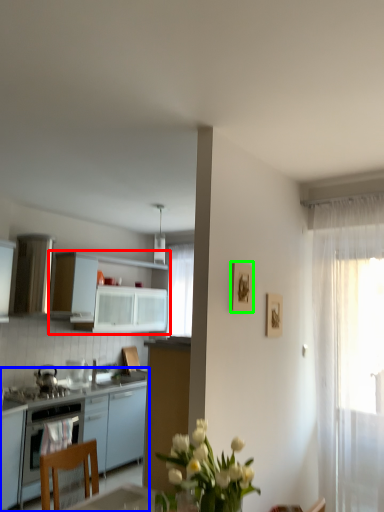
Question: Which is farther away from cabinetry (highlighted by a red box)? cabinetry (highlighted by a blue box) or picture frame (highlighted by a green box)?

Choices:
 (A) cabinetry
 (B) picture frame

Answer: (B)